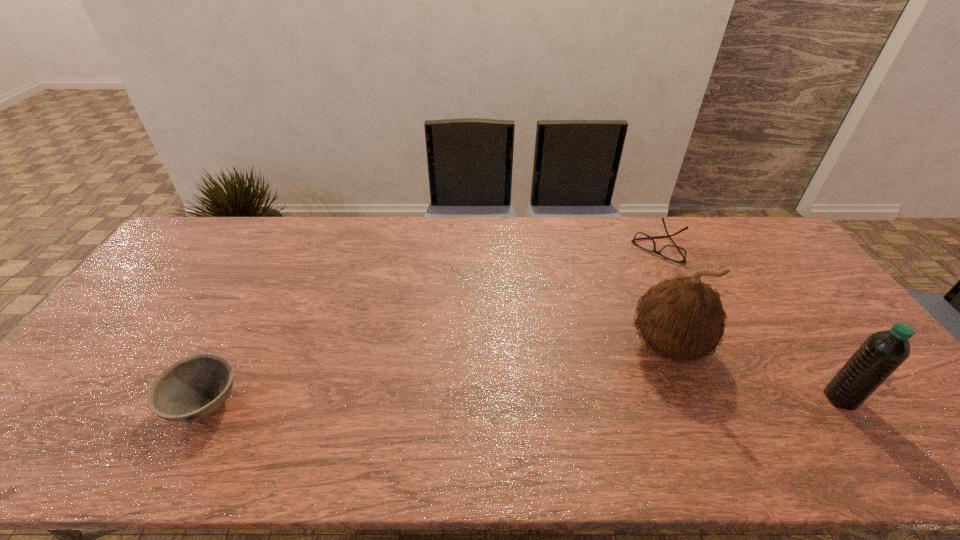
The image size is (960, 540). Find the location of `vacant area that lies between the coconut and the second shortest object`. vacant area that lies between the coconut and the second shortest object is located at coordinates (438, 375).

Where is `vacant area between the shortest object and the bowl`? vacant area between the shortest object and the bowl is located at coordinates (434, 325).

Where is `free area in between the tallest object and the leftmost object`? free area in between the tallest object and the leftmost object is located at coordinates (438, 375).

You are a GUI agent. You are given a task and a screenshot of the screen. Output one action in this format:
    pyautogui.click(x=<x>, y=<y>)
    Task: Click on the unoccupied area between the third tallest object and the rightmost object
    This screenshot has height=540, width=960.
    Given the screenshot: What is the action you would take?
    pyautogui.click(x=523, y=401)

Identify the location of free space between the leftmost object and the spectacles. (434, 325).

Select which object appears as the third closest to the bowl. Please provide its 2D coordinates. Your answer should be formatted as a tuple, i.e. [(x, y)], where the tuple contains the x and y coordinates of a point satisfying the conditions above.

[(883, 352)]

Identify the location of the third closest object to the coconut. The height and width of the screenshot is (540, 960). (194, 387).

This screenshot has height=540, width=960. Find the location of `vacant region that satisfies the following two spatial constraints: 1. on the back side of the bowl; 2. on the right side of the tallest object`. vacant region that satisfies the following two spatial constraints: 1. on the back side of the bowl; 2. on the right side of the tallest object is located at coordinates (236, 347).

The image size is (960, 540). Identify the location of vacant area that satisfies the following two spatial constraints: 1. on the back side of the tallest object; 2. on the left side of the farthest object. (629, 246).

Image resolution: width=960 pixels, height=540 pixels. What are the coordinates of `free spot that satisfies the following two spatial constraints: 1. on the back side of the tallest object; 2. on the left side of the shortest object` in the screenshot? It's located at (629, 246).